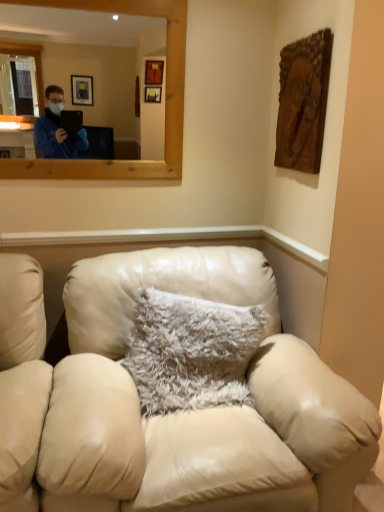
Question: Is wooden mirror at upper center located within fuzzy white pillow at center?

Choices:
 (A) yes
 (B) no

Answer: (B)

Question: Is fuzzy white pillow at center closer to the viewer compared to wooden mirror at upper center?

Choices:
 (A) yes
 (B) no

Answer: (A)

Question: From the image's perspective, is fuzzy white pillow at center above wooden mirror at upper center?

Choices:
 (A) yes
 (B) no

Answer: (B)

Question: Does fuzzy white pillow at center have a greater width compared to wooden mirror at upper center?

Choices:
 (A) no
 (B) yes

Answer: (B)

Question: Is fuzzy white pillow at center oriented away from wooden mirror at upper center?

Choices:
 (A) yes
 (B) no

Answer: (B)

Question: In the image, is leather couch at center on the left side or the right side of wooden mirror at upper center?

Choices:
 (A) left
 (B) right

Answer: (B)

Question: Is point (357, 404) closer or farther from the camera than point (122, 74)?

Choices:
 (A) farther
 (B) closer

Answer: (B)

Question: Is leather couch at center spatially inside wooden mirror at upper center, or outside of it?

Choices:
 (A) outside
 (B) inside

Answer: (A)

Question: Considering the positions of leather couch at center and wooden mirror at upper center in the image, is leather couch at center bigger or smaller than wooden mirror at upper center?

Choices:
 (A) small
 (B) big

Answer: (B)

Question: Is wooden mirror at upper center wider or thinner than fuzzy white pillow at center?

Choices:
 (A) wide
 (B) thin

Answer: (B)

Question: Looking at the image, does wooden mirror at upper center seem bigger or smaller compared to fuzzy white pillow at center?

Choices:
 (A) small
 (B) big

Answer: (A)

Question: From their relative heights in the image, would you say wooden mirror at upper center is taller or shorter than fuzzy white pillow at center?

Choices:
 (A) tall
 (B) short

Answer: (A)

Question: Is wooden mirror at upper center to the left or to the right of fuzzy white pillow at center in the image?

Choices:
 (A) left
 (B) right

Answer: (A)

Question: Based on their positions, is leather couch at center located to the left or right of fuzzy white pillow at center?

Choices:
 (A) left
 (B) right

Answer: (A)

Question: In the image, is leather couch at center positioned in front of or behind fuzzy white pillow at center?

Choices:
 (A) front
 (B) behind

Answer: (A)